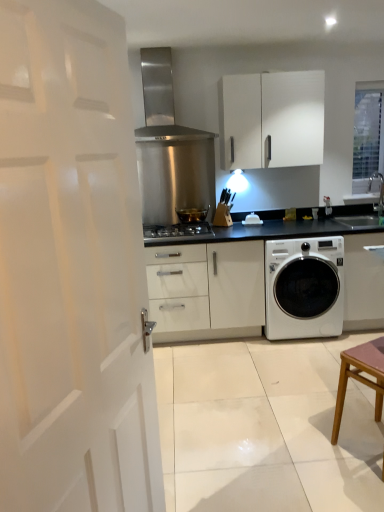
Question: From the image's perspective, is clear glass window at upper right located above white glossy washing machine at lower right?

Choices:
 (A) yes
 (B) no

Answer: (A)

Question: Can you confirm if clear glass window at upper right is wider than white glossy washing machine at lower right?

Choices:
 (A) yes
 (B) no

Answer: (B)

Question: Is clear glass window at upper right at the right side of white glossy washing machine at lower right?

Choices:
 (A) no
 (B) yes

Answer: (B)

Question: From a real-world perspective, is clear glass window at upper right below white glossy washing machine at lower right?

Choices:
 (A) yes
 (B) no

Answer: (B)

Question: Is clear glass window at upper right oriented towards white glossy washing machine at lower right?

Choices:
 (A) no
 (B) yes

Answer: (A)

Question: Does clear glass window at upper right have a lesser width compared to white glossy washing machine at lower right?

Choices:
 (A) no
 (B) yes

Answer: (B)

Question: Is white glossy sink at upper right in contact with white matte cabinet at upper center?

Choices:
 (A) no
 (B) yes

Answer: (A)

Question: Considering the relative positions of white glossy sink at upper right and white matte cabinet at upper center in the image provided, is white glossy sink at upper right behind white matte cabinet at upper center?

Choices:
 (A) yes
 (B) no

Answer: (B)

Question: Is white glossy sink at upper right far from white matte cabinet at upper center?

Choices:
 (A) no
 (B) yes

Answer: (B)

Question: Is white glossy sink at upper right completely or partially outside of white matte cabinet at upper center?

Choices:
 (A) yes
 (B) no

Answer: (A)

Question: Could you tell me if white glossy sink at upper right is facing white matte cabinet at upper center?

Choices:
 (A) yes
 (B) no

Answer: (B)

Question: Is white glossy sink at upper right at the left side of white matte cabinet at upper center?

Choices:
 (A) yes
 (B) no

Answer: (B)

Question: Can you confirm if white glossy sink at upper right is wider than stainless steel range hood at upper center?

Choices:
 (A) no
 (B) yes

Answer: (A)